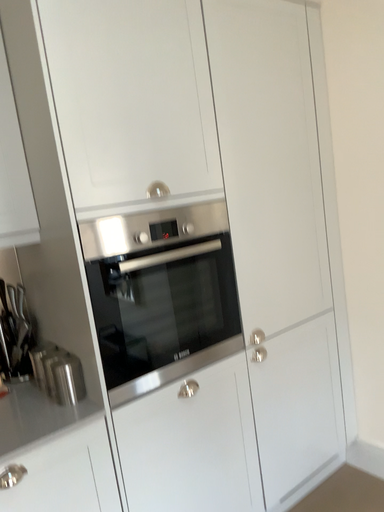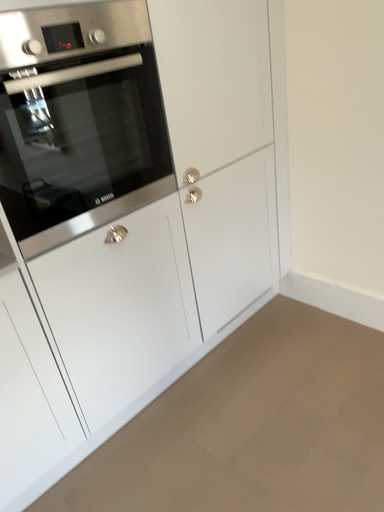
Question: How did the camera likely rotate when shooting the video?

Choices:
 (A) rotated left
 (B) rotated right

Answer: (B)